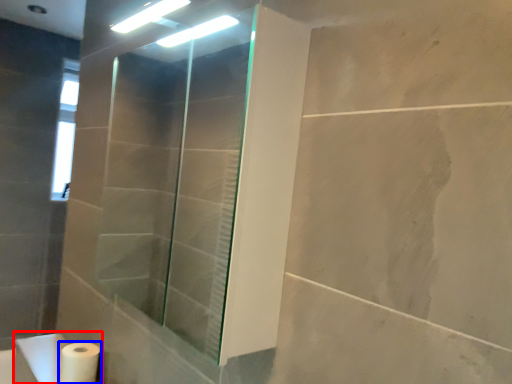
Question: Which object is further to the camera taking this photo, sink (highlighted by a red box) or toilet paper (highlighted by a blue box)?

Choices:
 (A) sink
 (B) toilet paper

Answer: (B)